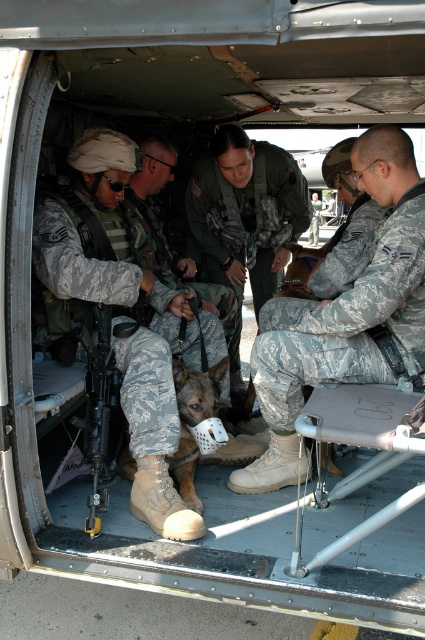
Can you confirm if camouflage fabric uniform at center is thinner than camouflage fabric dog at center?

No.

Image resolution: width=425 pixels, height=640 pixels. Describe the element at coordinates (346, 314) in the screenshot. I see `camouflage fabric uniform at center` at that location.

Locate an element on the screen. This screenshot has height=640, width=425. camouflage fabric uniform at center is located at coordinates (346, 314).

Consider the image. Who is shorter, camouflage fabric uniform at center or dark brown fur at center?

dark brown fur at center is shorter.

Who is positioned more to the left, camouflage fabric uniform at center or dark brown fur at center?

From the viewer's perspective, dark brown fur at center appears more on the left side.

Which is behind, point (305, 321) or point (308, 248)?

Point (308, 248)

Where is `camouflage fabric uniform at center`? The width and height of the screenshot is (425, 640). camouflage fabric uniform at center is located at coordinates (346, 314).

Between camouflage uniform at center and camouflage fabric dog at center, which one has more height?

camouflage uniform at center is taller.

Does camouflage uniform at center lie in front of camouflage fabric dog at center?

Yes.

This screenshot has height=640, width=425. What are the coordinates of `camouflage uniform at center` in the screenshot? It's located at (127, 356).